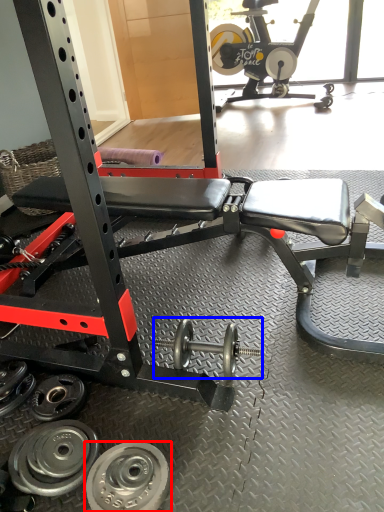
Question: Among these objects, which one is nearest to the camera, wheel (highlighted by a red box) or dumbbell (highlighted by a blue box)?

Choices:
 (A) wheel
 (B) dumbbell

Answer: (A)